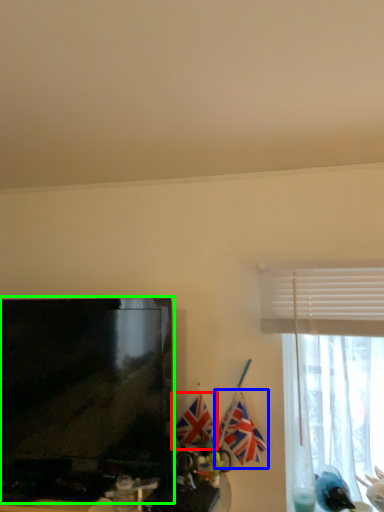
Question: Estimate the real-world distances between objects in this image. Which object is closer to flag (highlighted by a red box), flag (highlighted by a blue box) or television (highlighted by a green box)?

Choices:
 (A) flag
 (B) television

Answer: (A)